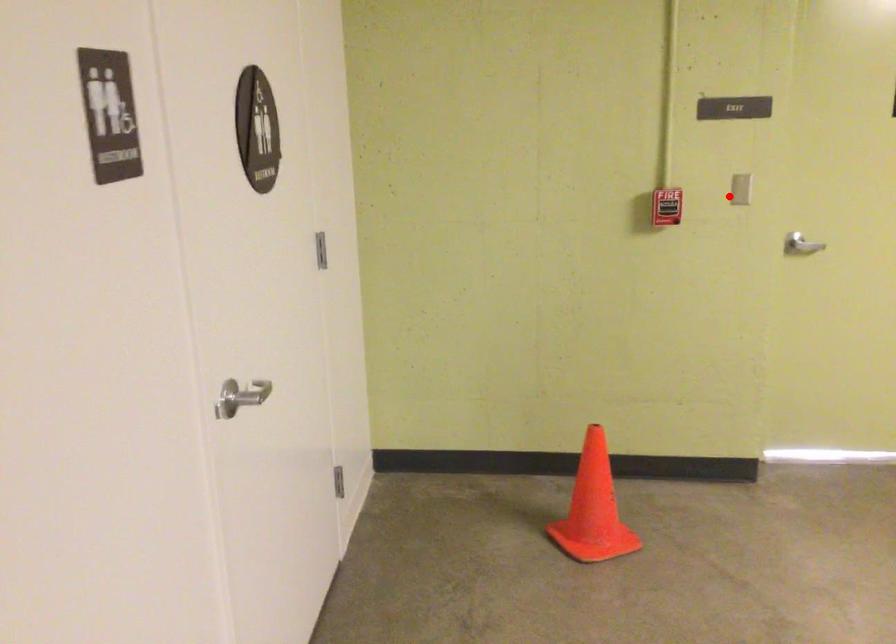
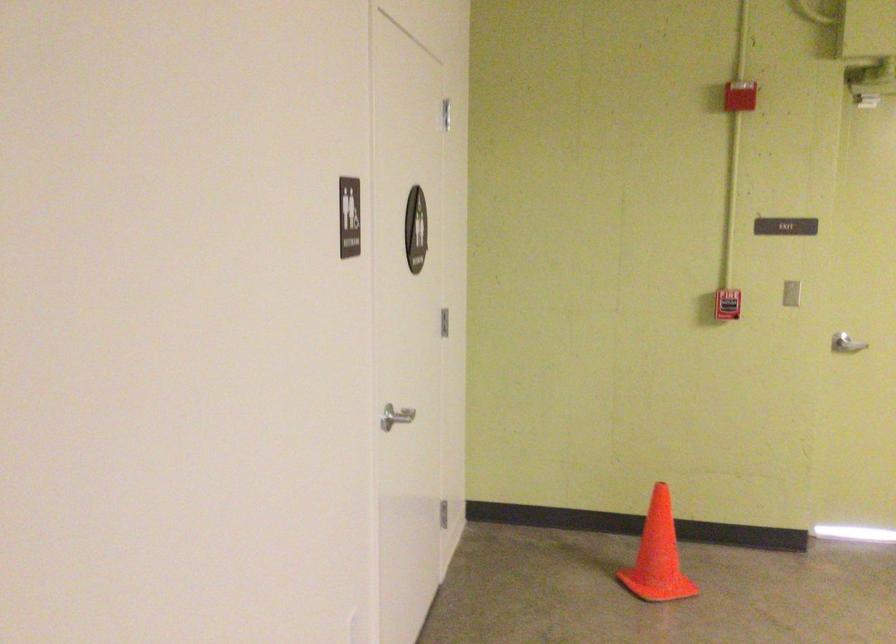
Question: I am providing you with two images of the same scene from different viewpoints. In image1, a red point is highlighted. Considering the same 3D point in image2, which of the following is correct?

Choices:
 (A) It is closer
 (B) It is farther

Answer: (B)